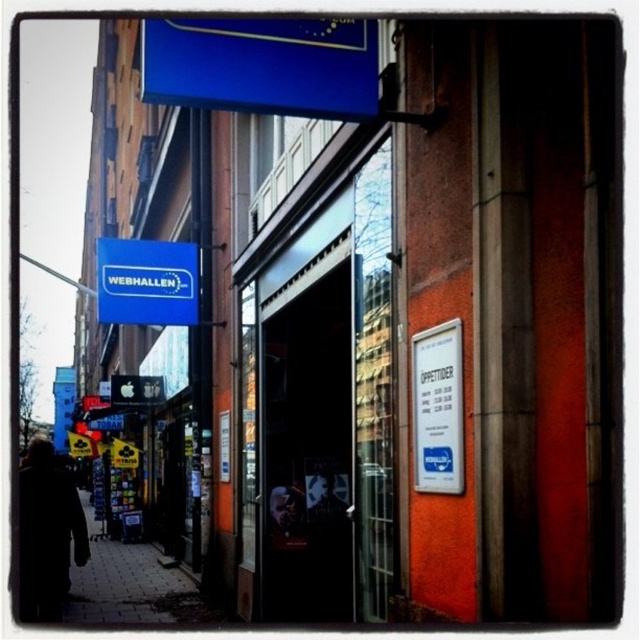
Which is more to the left, black coat at lower left or blue matte sign at upper left?

Positioned to the left is black coat at lower left.

Identify the location of black coat at lower left. The image size is (640, 640). (45, 532).